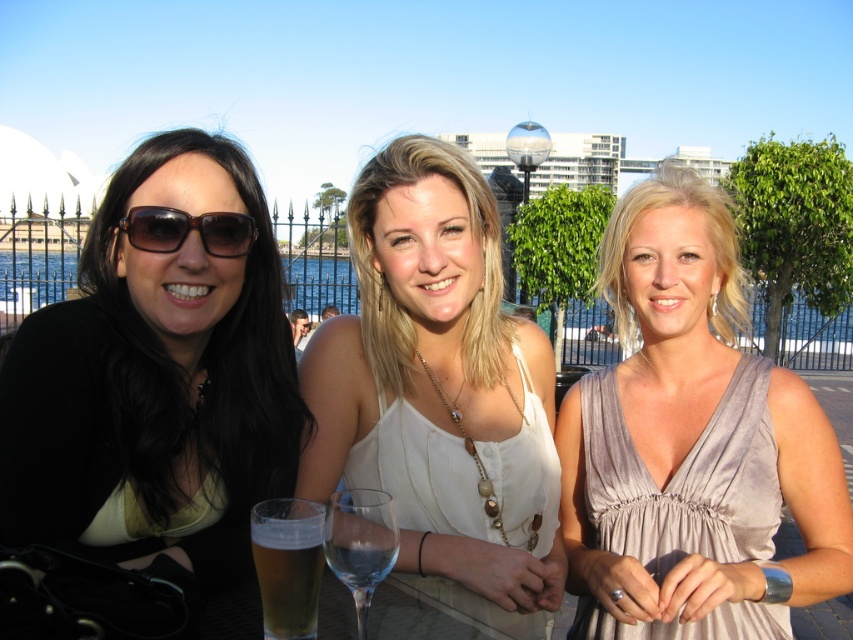
Question: Can you confirm if white satin blouse at center is positioned to the right of brown shiny sunglasses at left?

Choices:
 (A) no
 (B) yes

Answer: (B)

Question: Which point appears farthest from the camera in this image?

Choices:
 (A) (596, 592)
 (B) (318, 516)
 (C) (335, 557)

Answer: (A)

Question: Which of the following is the closest to the observer?

Choices:
 (A) (283, 365)
 (B) (334, 548)
 (C) (704, 419)

Answer: (B)

Question: Estimate the real-world distances between objects in this image. Which object is farther from the brown shiny sunglasses at left?

Choices:
 (A) satin dress at center
 (B) matte black sunglasses at left
 (C) clear glass wine at center
 (D) white satin blouse at center

Answer: (A)

Question: Is transparent glass wine glass at center to the left of brown shiny sunglasses at left from the viewer's perspective?

Choices:
 (A) no
 (B) yes

Answer: (A)

Question: Is golden translucent glass at lower left bigger than clear glass wine at center?

Choices:
 (A) no
 (B) yes

Answer: (B)